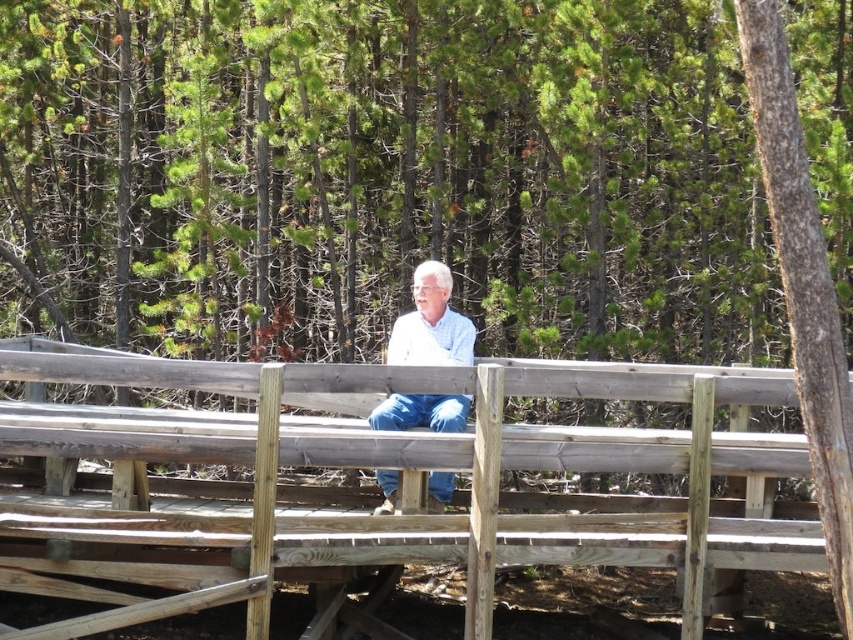
You are standing on the wooden bridge in the forest and notice the weathered wood rail at center and the light blue denim jeans at center. Which object is positioned lower in the scene?

The weathered wood rail at center is below light blue denim jeans at center, so the weathered wood rail at center is positioned lower in the scene.

You are standing on the wooden bridge in the forest and see two points marked on the bridge. Which point is closer to you, point (737, 563) or point (415, 268)?

Point (737, 563) is closer to the viewer than point (415, 268).

Based on the photo, you are a hiker who wants to sit on the wooden bridge. You notice the weathered wood rail at center and the light blue denim jeans at center. Which object is shorter in height?

The weathered wood rail at center has a lesser height compared to the light blue denim jeans at center, so the weathered wood rail at center is shorter in height.